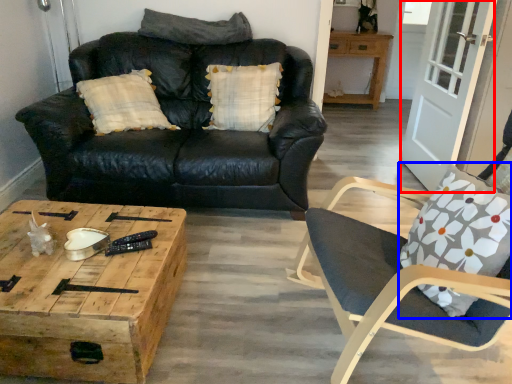
Question: Which object appears farthest to the camera in this image, screen door (highlighted by a red box) or throw pillow (highlighted by a blue box)?

Choices:
 (A) screen door
 (B) throw pillow

Answer: (A)